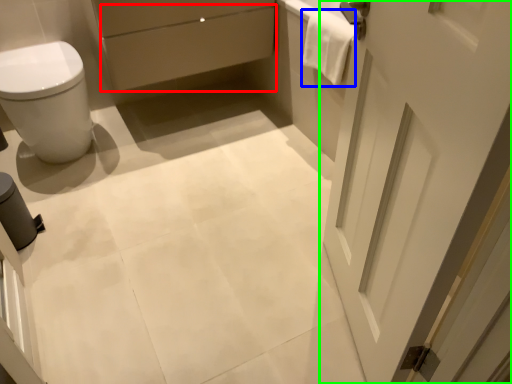
Question: Estimate the real-world distances between objects in this image. Which object is farther from drawer (highlighted by a red box), material (highlighted by a blue box) or door (highlighted by a green box)?

Choices:
 (A) material
 (B) door

Answer: (B)